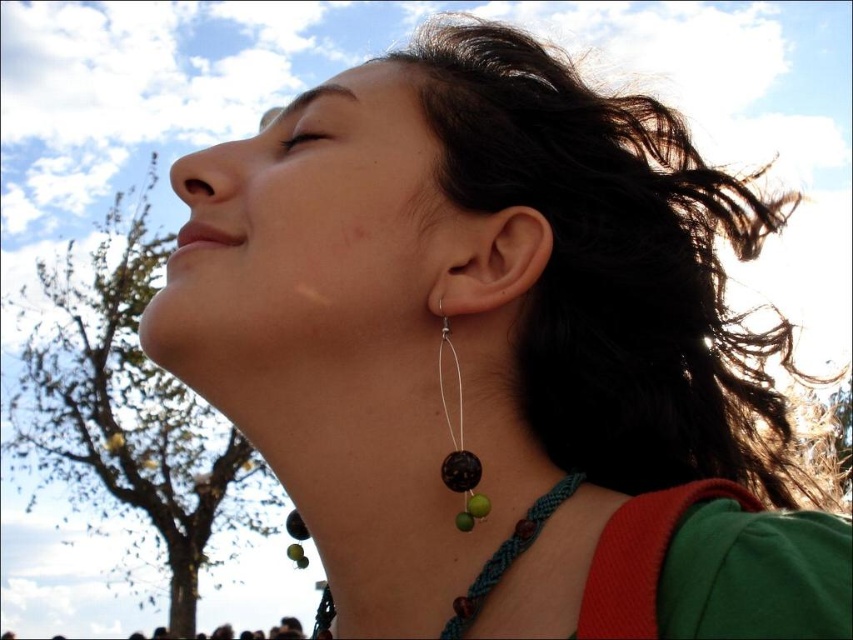
Question: Where is dark brown hair at upper right located in relation to matte skin at center in the image?

Choices:
 (A) left
 (B) right

Answer: (B)

Question: Which point is closer to the camera?

Choices:
 (A) green leafy tree at left
 (B) dark brown hair at upper right

Answer: (B)

Question: Considering the real-world distances, which object is farthest from the black matte bead at ear?

Choices:
 (A) black beaded necklace at center
 (B) green leafy tree at left
 (C) matte silver earring at center-right
 (D) matte skin at center

Answer: (B)

Question: Based on their relative distances, which object is farther from the dark brown hair at upper right?

Choices:
 (A) green leafy tree at left
 (B) matte silver earring at center-right

Answer: (A)

Question: Is dark brown hair at upper right below matte silver earring at center-right?

Choices:
 (A) yes
 (B) no

Answer: (B)

Question: Is dark brown hair at upper right thinner than green leafy tree at left?

Choices:
 (A) no
 (B) yes

Answer: (B)